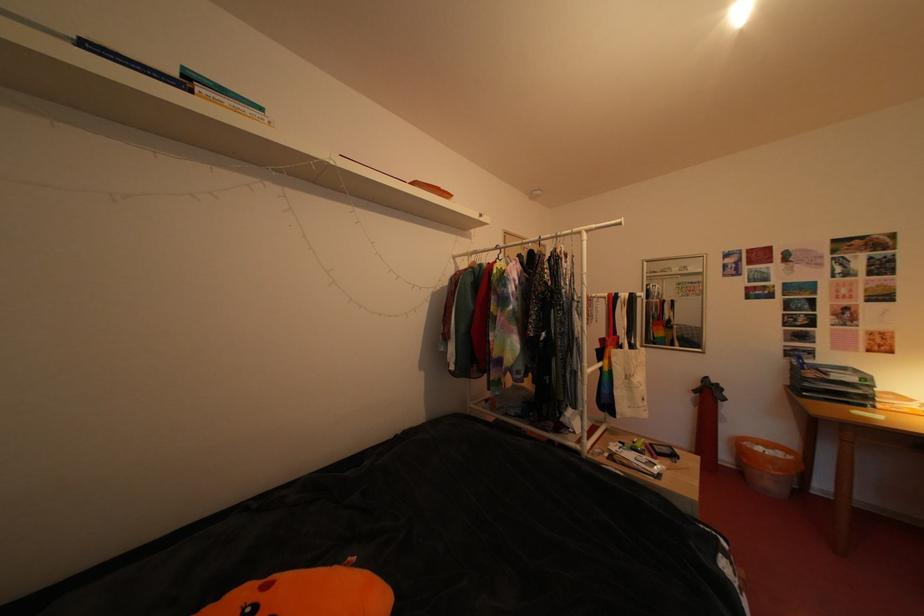
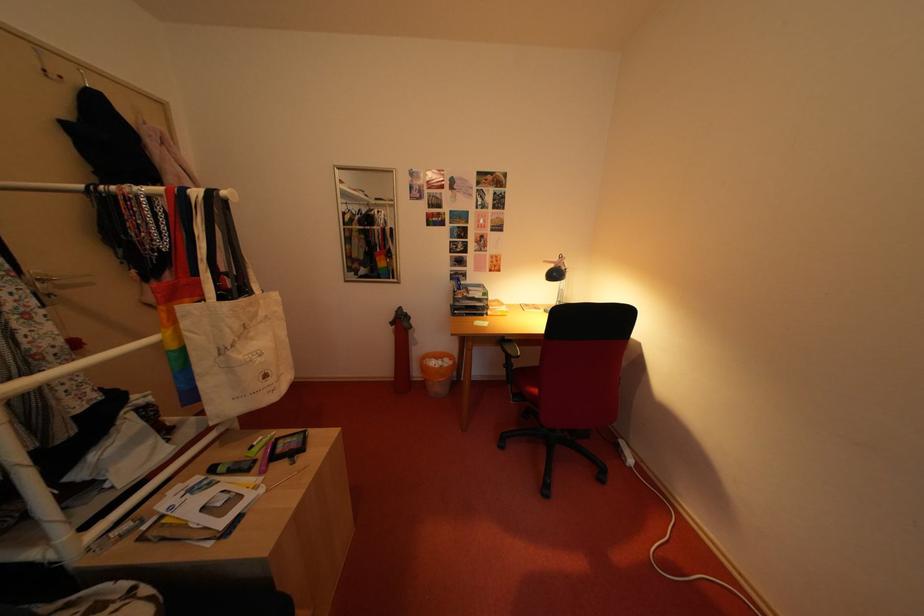
The first image is from the beginning of the video and the second image is from the end. How did the camera likely rotate when shooting the video?

→ The camera rotated toward right-down.